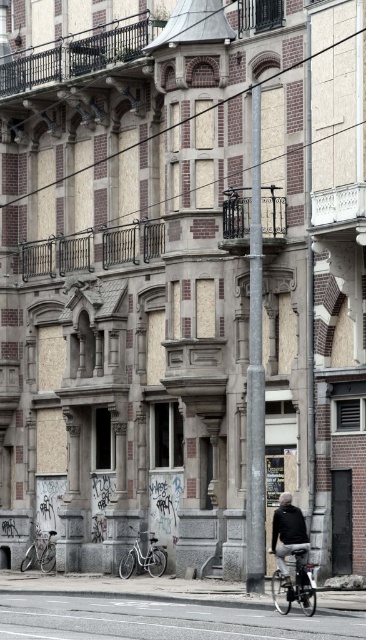
Who is positioned more to the left, white matte bicycle at lower center or silver metallic bicycle at lower left?

silver metallic bicycle at lower left is more to the left.

Between point (140, 531) and point (49, 547), which one is positioned behind?

Point (49, 547)

This screenshot has height=640, width=366. I want to click on white matte bicycle at lower center, so click(143, 557).

How much distance is there between dark gray jacket at center and silver metallic bicycle at lower left?

dark gray jacket at center is 77.70 feet from silver metallic bicycle at lower left.

Is dark gray jacket at center smaller than silver metallic bicycle at lower left?

No.

Is point (284, 554) positioned in front of point (40, 554)?

Yes, point (284, 554) is in front of point (40, 554).

This screenshot has height=640, width=366. Find the location of `dark gray jacket at center`. dark gray jacket at center is located at coordinates click(288, 531).

Does point (281, 605) come farther from viewer compared to point (152, 570)?

That is False.

This screenshot has width=366, height=640. What do you see at coordinates (294, 586) in the screenshot? I see `shiny metallic bicycle at center` at bounding box center [294, 586].

You are a GUI agent. You are given a task and a screenshot of the screen. Output one action in this format:
    pyautogui.click(x=<x>, y=<y>)
    Task: Click on the shiny metallic bicycle at center
    
    Given the screenshot: What is the action you would take?
    pyautogui.click(x=294, y=586)